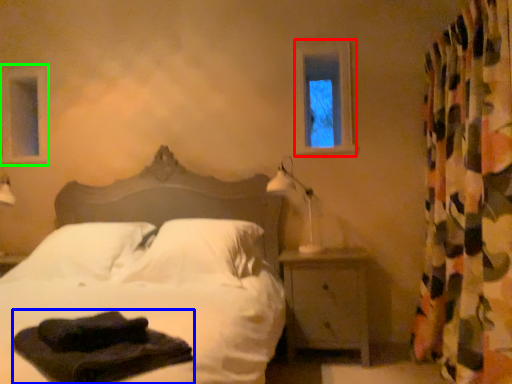
Question: Which is farther away from window frame (highlighted by a red box)? material (highlighted by a blue box) or window frame (highlighted by a green box)?

Choices:
 (A) material
 (B) window frame

Answer: (B)